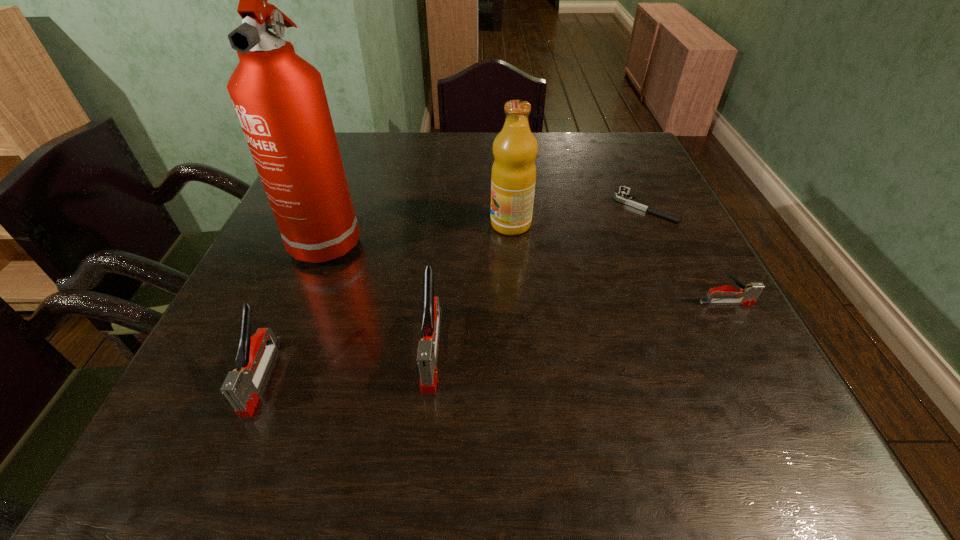
Please point a location where one more stapler_(stapling_machine) can be added evenly. Please provide its 2D coordinates. Your answer should be formatted as a tuple, i.e. [(x, y)], where the tuple contains the x and y coordinates of a point satisfying the conditions above.

[(587, 325)]